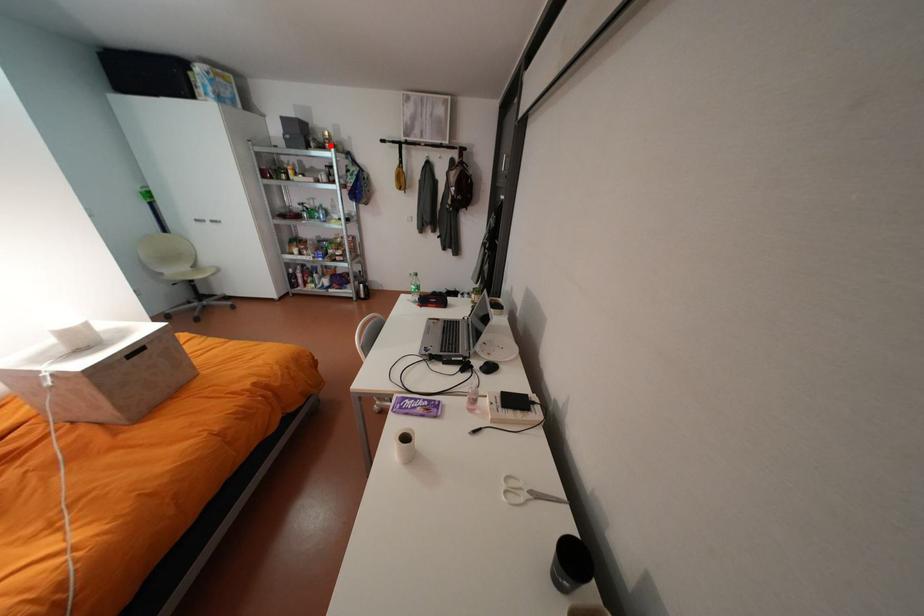
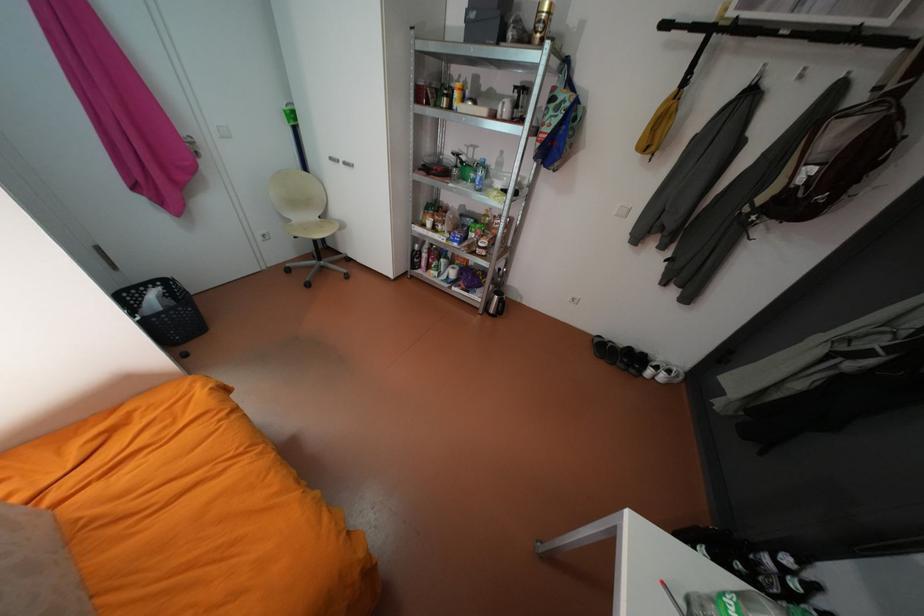
Locate, in the second image, the point that corresponds to the highlighted location in the first image.

(533, 39)